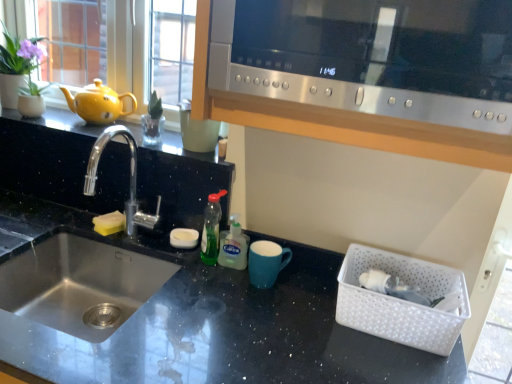
Locate an element on the screen. This screenshot has width=512, height=384. black granite countertop at center is located at coordinates (181, 279).

This screenshot has width=512, height=384. What do you see at coordinates (109, 223) in the screenshot?
I see `yellow sponge at sink` at bounding box center [109, 223].

Image resolution: width=512 pixels, height=384 pixels. What do you see at coordinates (17, 66) in the screenshot? I see `green matte plant at upper left` at bounding box center [17, 66].

Measure the distance between point (253,261) and camera.

The distance of point (253,261) from camera is 3.65 feet.

Find the location of a particular element. The image size is (512, 384). green translucent soap dispenser at center, which is the first bottle from right to left is located at coordinates (233, 246).

What do you see at coordinates (211, 229) in the screenshot?
I see `green translucent bottle at center, which is counted as the 2th bottle, starting from the right` at bounding box center [211, 229].

Where is `silver metallic faucet at left`? The height and width of the screenshot is (384, 512). silver metallic faucet at left is located at coordinates (130, 179).

Considering their positions, is yellow sponge at sink located in front of or behind silver metallic faucet at left?

In the image, yellow sponge at sink appears behind silver metallic faucet at left.

Which of these two, yellow sponge at sink or silver metallic faucet at left, is thinner?

yellow sponge at sink.

Looking at the image, does yellow sponge at sink seem bigger or smaller compared to silver metallic faucet at left?

Clearly, yellow sponge at sink is smaller in size than silver metallic faucet at left.

Which is more to the left, yellow sponge at sink or silver metallic faucet at left?

Positioned to the left is yellow sponge at sink.

From a real-world perspective, is green translucent bottle at center, which is counted as the 2th bottle, starting from the right, physically located above or below yellow sponge at sink?

green translucent bottle at center, which is counted as the 2th bottle, starting from the right, is situated higher than yellow sponge at sink in the real world.

Is green translucent bottle at center, the 1th bottle from the left, looking in the opposite direction of yellow sponge at sink?

No, green translucent bottle at center, the 1th bottle from the left,'s orientation is not away from yellow sponge at sink.

Does green translucent bottle at center, which is counted as the 2th bottle, starting from the right, lie in front of yellow sponge at sink?

Yes, green translucent bottle at center, which is counted as the 2th bottle, starting from the right, is closer to the camera.

Between green translucent bottle at center, which is counted as the 2th bottle, starting from the right, and yellow sponge at sink, which one has smaller size?

yellow sponge at sink is smaller.

From their relative heights in the image, would you say satin silver microwave at upper center is taller or shorter than green translucent bottle at center, which is counted as the 2th bottle, starting from the right?

In the image, satin silver microwave at upper center appears to be taller than green translucent bottle at center, which is counted as the 2th bottle, starting from the right.

Considering the relative sizes of satin silver microwave at upper center and green translucent bottle at center, which is counted as the 2th bottle, starting from the right, in the image provided, is satin silver microwave at upper center thinner than green translucent bottle at center, which is counted as the 2th bottle, starting from the right,?

No, satin silver microwave at upper center is not thinner than green translucent bottle at center, which is counted as the 2th bottle, starting from the right.

Is satin silver microwave at upper center positioned behind green translucent bottle at center, the 1th bottle from the left?

That is False.

Where is `microwave above the yellow matte teapot at left (from a real-world perspective)`? The height and width of the screenshot is (384, 512). microwave above the yellow matte teapot at left (from a real-world perspective) is located at coordinates (371, 56).

Is satin silver microwave at upper center positioned far away from yellow matte teapot at left?

No, satin silver microwave at upper center is not far away from yellow matte teapot at left.

Measure the distance between satin silver microwave at upper center and yellow matte teapot at left.

A distance of 37.49 inches exists between satin silver microwave at upper center and yellow matte teapot at left.

Is satin silver microwave at upper center thinner than yellow matte teapot at left?

Incorrect, the width of satin silver microwave at upper center is not less than that of yellow matte teapot at left.

Which of these two, yellow matte teapot at left or black granite countertop at center, is thinner?

Thinner between the two is yellow matte teapot at left.

From the image's perspective, is yellow matte teapot at left located above or below black granite countertop at center?

yellow matte teapot at left is situated higher than black granite countertop at center in the image.

How distant is yellow matte teapot at left from black granite countertop at center?

18.46 inches.

Considering the sizes of objects yellow matte teapot at left and black granite countertop at center in the image provided, who is bigger, yellow matte teapot at left or black granite countertop at center?

black granite countertop at center.

From the image's perspective, relative to matte blue mug at center, is green translucent bottle at center, the 1th bottle from the left, above or below?

Based on their image positions, green translucent bottle at center, the 1th bottle from the left, is located above matte blue mug at center.

Consider the image. In the image, is green translucent bottle at center, the 1th bottle from the left, positioned in front of or behind matte blue mug at center?

green translucent bottle at center, the 1th bottle from the left, is behind matte blue mug at center.

Find the location of a particular element. mug below the green translucent bottle at center, which is counted as the 2th bottle, starting from the right (from a real-world perspective) is located at coordinates (266, 262).

Can you tell me how much green translucent bottle at center, the 1th bottle from the left, and matte blue mug at center differ in facing direction?

There is a 0.936-degree angle between the facing directions of green translucent bottle at center, the 1th bottle from the left, and matte blue mug at center.

Between matte blue mug at center and green matte plant at upper left, which one has larger width?

With larger width is green matte plant at upper left.

Locate an element on the screen. This screenshot has width=512, height=384. plant behind the matte blue mug at center is located at coordinates (17, 66).

Is matte blue mug at center facing towards green matte plant at upper left?

No.

Considering the points (272, 248) and (12, 78), which point is in front, point (272, 248) or point (12, 78)?

The point (272, 248) is in front.

This screenshot has width=512, height=384. What are the coordinates of `food below the silver metallic faucet at left (from the image's perspective)` in the screenshot? It's located at [109, 223].

You are a GUI agent. You are given a task and a screenshot of the screen. Output one action in this format:
    pyautogui.click(x=<x>, y=<y>)
    Task: Click on the bottle lying above the yellow sponge at sink (from the image's perspective)
    Image resolution: width=512 pixels, height=384 pixels.
    Given the screenshot: What is the action you would take?
    pyautogui.click(x=211, y=229)

Looking at the image, which one is located further to silver metallic faucet at left, black granite countertop at center or yellow matte teapot at left?

black granite countertop at center is further to silver metallic faucet at left.

Which object lies further to the anchor point matte blue mug at center, yellow sponge at sink or black granite countertop at center?

yellow sponge at sink is further to matte blue mug at center.

In the scene shown: When comparing their distances from matte blue mug at center, does satin silver microwave at upper center or green matte plant at upper left seem further?

green matte plant at upper left is further to matte blue mug at center.

Estimate the real-world distances between objects in this image. Which object is closer to white plastic basket at lower right, satin silver microwave at upper center or silver metallic faucet at left?

The object closer to white plastic basket at lower right is satin silver microwave at upper center.

When comparing their distances from white plastic basket at lower right, does yellow sponge at sink or satin silver microwave at upper center seem further?

Based on the image, yellow sponge at sink appears to be further to white plastic basket at lower right.

Based on their spatial positions, is satin silver microwave at upper center or black granite countertop at center further from green translucent bottle at center, which is counted as the 2th bottle, starting from the right?

The object further to green translucent bottle at center, which is counted as the 2th bottle, starting from the right, is satin silver microwave at upper center.

Which object lies further to the anchor point yellow sponge at sink, green matte plant at upper left or matte blue mug at center?

The object further to yellow sponge at sink is green matte plant at upper left.

Considering their positions, is green translucent soap dispenser at center, which appears as the 2th bottle when viewed from the left, positioned further to matte blue mug at center than green matte plant at upper left?

green matte plant at upper left.

I want to click on tap between yellow matte teapot at left and white plastic basket at lower right from left to right, so click(x=130, y=179).

You are a GUI agent. You are given a task and a screenshot of the screen. Output one action in this format:
    pyautogui.click(x=<x>, y=<y>)
    Task: Click on the tap between green matte plant at upper left and matte blue mug at center
    The image size is (512, 384).
    Given the screenshot: What is the action you would take?
    pyautogui.click(x=130, y=179)

Where is `tea pot that lies between green matte plant at upper left and yellow sponge at sink from top to bottom`? This screenshot has width=512, height=384. tea pot that lies between green matte plant at upper left and yellow sponge at sink from top to bottom is located at coordinates (98, 103).

You are a GUI agent. You are given a task and a screenshot of the screen. Output one action in this format:
    pyautogui.click(x=<x>, y=<y>)
    Task: Click on the bottle located between silver metallic faucet at left and green translucent soap dispenser at center, which appears as the 2th bottle when viewed from the left, in the left-right direction
    This screenshot has height=384, width=512.
    Given the screenshot: What is the action you would take?
    pyautogui.click(x=211, y=229)